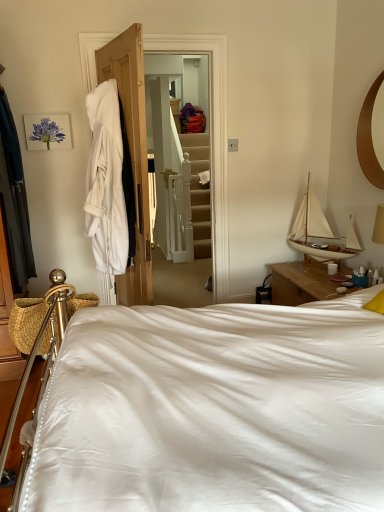
Where is `free space to the left of white ceramic mug at upper right`? This screenshot has height=512, width=384. free space to the left of white ceramic mug at upper right is located at coordinates (311, 277).